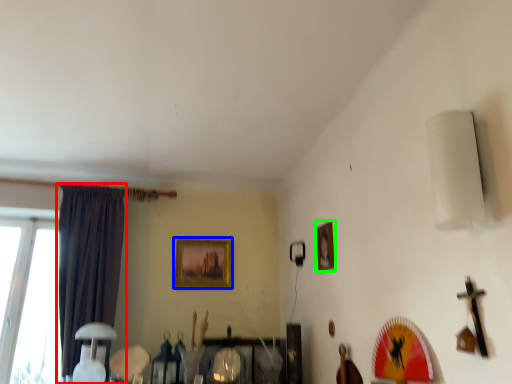
Question: Based on their relative distances, which object is farther from curtain (highlighted by a red box)? Choose from picture frame (highlighted by a blue box) and picture frame (highlighted by a green box).

Choices:
 (A) picture frame
 (B) picture frame

Answer: (B)